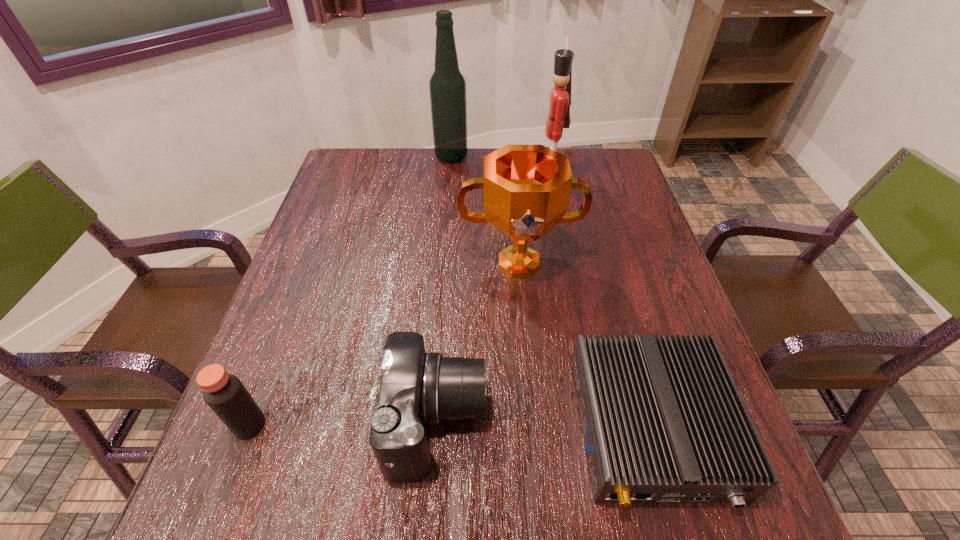
Find the location of a particular element. The image size is (960, 540). the farthest object is located at coordinates (447, 85).

The height and width of the screenshot is (540, 960). Find the location of `nutcracker`. nutcracker is located at coordinates (558, 117).

Where is `the third farthest object`? the third farthest object is located at coordinates (526, 188).

Where is `the third tallest object`? Image resolution: width=960 pixels, height=540 pixels. the third tallest object is located at coordinates (526, 188).

Identify the location of the leftmost object. (224, 393).

Locate an element on the screen. camera is located at coordinates (415, 388).

Locate an element on the screen. the shortest object is located at coordinates (663, 421).

You are a GUI agent. You are given a task and a screenshot of the screen. Output one action in this format:
    pyautogui.click(x=<x>, y=<y>)
    Task: Click on the free space located 0.260m on the right of the farthest object
    The image size is (960, 540).
    Given the screenshot: What is the action you would take?
    pyautogui.click(x=548, y=157)

You are a GUI agent. You are given a task and a screenshot of the screen. Output one action in this format:
    pyautogui.click(x=<x>, y=<y>)
    Task: Click on the vacant space situated 0.170m on the front-facing side of the second farthest object
    
    Given the screenshot: What is the action you would take?
    pyautogui.click(x=477, y=179)

Find the location of a particular element. This screenshot has height=540, width=960. vacant space located on the front-facing side of the second farthest object is located at coordinates (450, 179).